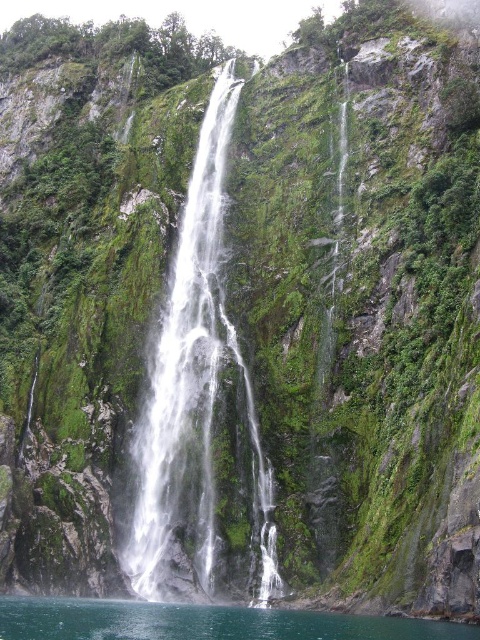
Question: Among these points, which one is farthest from the camera?

Choices:
 (A) (132, 636)
 (B) (260, 454)

Answer: (B)

Question: Where is white glossy waterfall at center located in relation to clear water at lower center in the image?

Choices:
 (A) above
 (B) below

Answer: (A)

Question: Among these points, which one is nearest to the camera?

Choices:
 (A) (192, 621)
 (B) (186, 358)

Answer: (A)

Question: Does white glossy waterfall at center lie in front of clear water at lower center?

Choices:
 (A) no
 (B) yes

Answer: (A)

Question: Which of the following is the farthest from the observer?

Choices:
 (A) (105, 632)
 (B) (177, 326)

Answer: (B)

Question: Does white glossy waterfall at center have a lesser width compared to clear water at lower center?

Choices:
 (A) yes
 (B) no

Answer: (A)